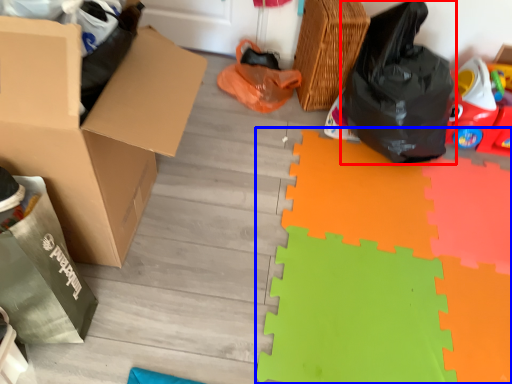
Question: Which point is further to the camera, plastic bag (highlighted by a red box) or doormat (highlighted by a blue box)?

Choices:
 (A) plastic bag
 (B) doormat

Answer: (A)